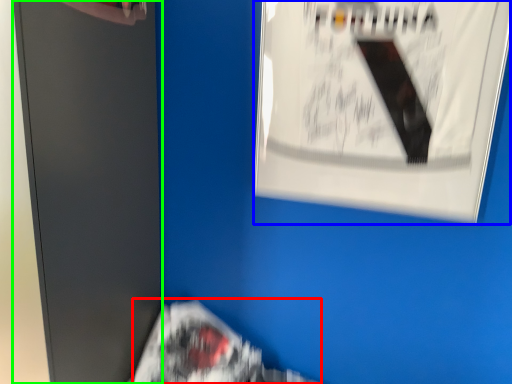
Question: Estimate the real-world distances between objects in this image. Which object is farther from flyer (highlighted by a red box), poster (highlighted by a blue box) or file cabinet (highlighted by a green box)?

Choices:
 (A) poster
 (B) file cabinet

Answer: (A)